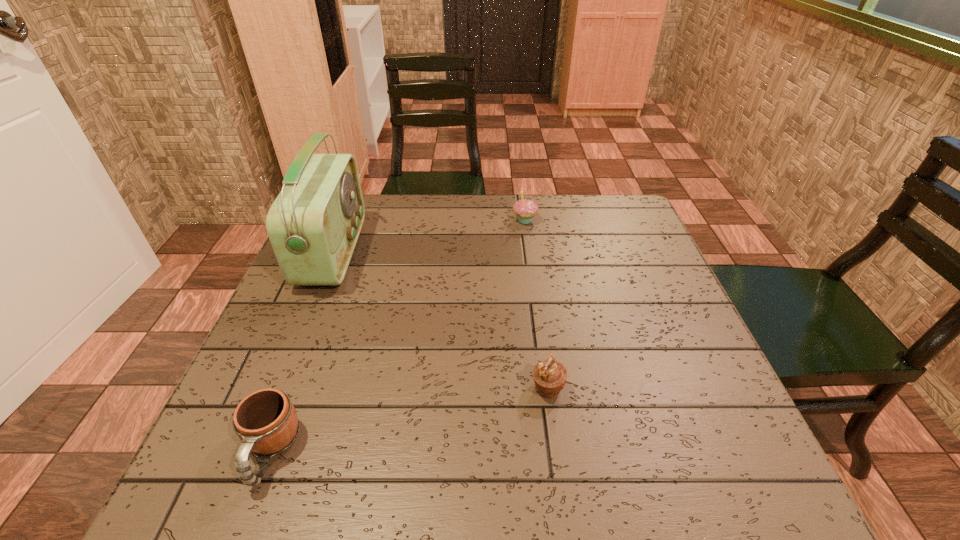
You are a GUI agent. You are given a task and a screenshot of the screen. Output one action in this format:
    pyautogui.click(x=<x>, y=<y>)
    Task: Click on the vacant space that is in between the mug and the radio receiver
    The image size is (960, 540).
    Given the screenshot: What is the action you would take?
    pyautogui.click(x=301, y=352)

The width and height of the screenshot is (960, 540). In order to click on empty space that is in between the mug and the cupcake in this screenshot , I will do `click(397, 335)`.

Find the location of `empty location between the tallest object and the mug`. empty location between the tallest object and the mug is located at coordinates (301, 352).

Find the location of `empty location between the tallest object and the mug`. empty location between the tallest object and the mug is located at coordinates (301, 352).

Image resolution: width=960 pixels, height=540 pixels. In order to click on empty location between the cupcake and the nearest object in this screenshot , I will do `click(397, 335)`.

Where is `free space between the nearest object and the third farthest object`? The width and height of the screenshot is (960, 540). free space between the nearest object and the third farthest object is located at coordinates (409, 420).

Image resolution: width=960 pixels, height=540 pixels. Find the location of `empty location between the tallest object and the cupcake`. empty location between the tallest object and the cupcake is located at coordinates (429, 236).

Where is `free point between the nearest object and the cupcake`? Image resolution: width=960 pixels, height=540 pixels. free point between the nearest object and the cupcake is located at coordinates (397, 335).

Where is `free space between the radio receiver and the nearest object`? The width and height of the screenshot is (960, 540). free space between the radio receiver and the nearest object is located at coordinates (301, 352).

This screenshot has height=540, width=960. Find the location of `object that is the nearest to the mug`. object that is the nearest to the mug is located at coordinates (313, 225).